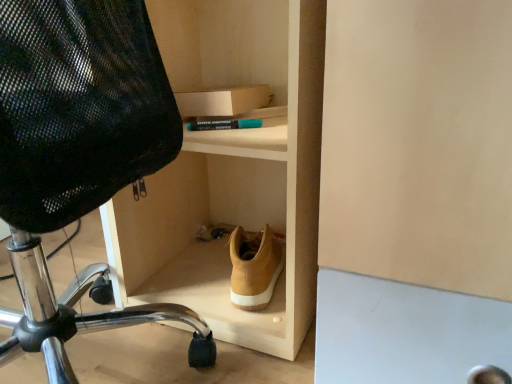
Question: From a real-world perspective, is tan suede shoe at center located beneath black mesh chair at left?

Choices:
 (A) no
 (B) yes

Answer: (B)

Question: Can you confirm if tan suede shoe at center is thinner than black mesh chair at left?

Choices:
 (A) yes
 (B) no

Answer: (A)

Question: Does tan suede shoe at center have a smaller size compared to black mesh chair at left?

Choices:
 (A) yes
 (B) no

Answer: (A)

Question: Is tan suede shoe at center bigger than black mesh chair at left?

Choices:
 (A) yes
 (B) no

Answer: (B)

Question: Considering the relative sizes of tan suede shoe at center and black mesh chair at left in the image provided, is tan suede shoe at center wider than black mesh chair at left?

Choices:
 (A) yes
 (B) no

Answer: (B)

Question: Can we say tan suede shoe at center lies outside black mesh chair at left?

Choices:
 (A) yes
 (B) no

Answer: (A)

Question: Are light wood shoe at lower center and black mesh chair at left located far from each other?

Choices:
 (A) no
 (B) yes

Answer: (A)

Question: Is light wood shoe at lower center turned away from black mesh chair at left?

Choices:
 (A) yes
 (B) no

Answer: (B)

Question: Can you confirm if light wood shoe at lower center is wider than black mesh chair at left?

Choices:
 (A) yes
 (B) no

Answer: (B)

Question: Is light wood shoe at lower center beside black mesh chair at left?

Choices:
 (A) yes
 (B) no

Answer: (B)

Question: From a real-world perspective, is light wood shoe at lower center located higher than black mesh chair at left?

Choices:
 (A) yes
 (B) no

Answer: (A)

Question: Considering the relative sizes of light wood shoe at lower center and black mesh chair at left in the image provided, is light wood shoe at lower center bigger than black mesh chair at left?

Choices:
 (A) yes
 (B) no

Answer: (B)

Question: Is black mesh chair at left outside of light wood shoe at lower center?

Choices:
 (A) no
 (B) yes

Answer: (B)